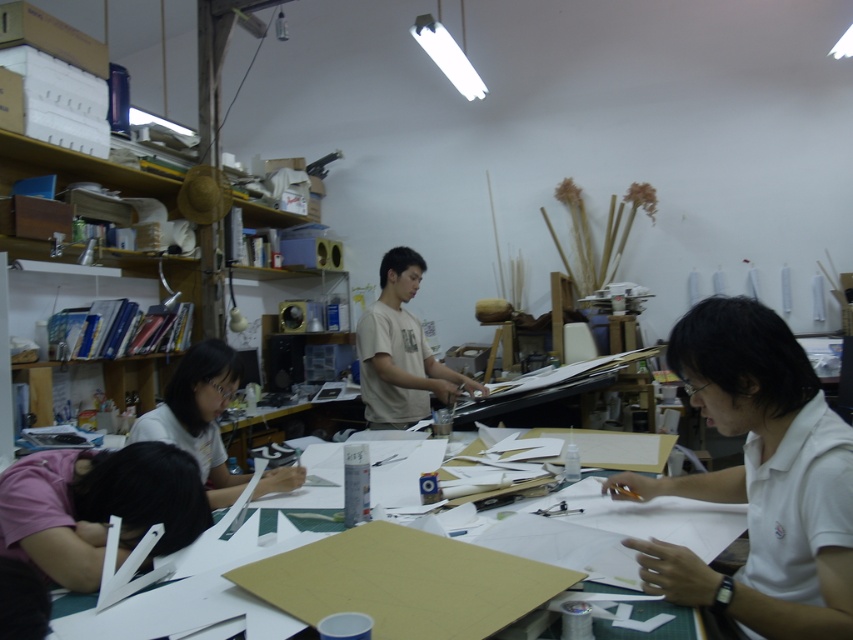
Question: Does white matte shirt at lower right have a smaller size compared to white matte shirt at center?

Choices:
 (A) no
 (B) yes

Answer: (A)

Question: Which of these objects is positioned farthest from the white matte shirt at center?

Choices:
 (A) white matte shirt at lower right
 (B) white paper at center
 (C) light brown t-shirt at center

Answer: (A)

Question: Which of the following is the closest to the observer?

Choices:
 (A) white matte shirt at center
 (B) light brown t-shirt at center
 (C) white matte shirt at lower right

Answer: (C)

Question: Which point is closer to the camera taking this photo?

Choices:
 (A) (456, 396)
 (B) (795, 342)
 (C) (680, 538)
 (D) (186, 385)

Answer: (B)

Question: Does white paper at center have a smaller size compared to light brown t-shirt at center?

Choices:
 (A) no
 (B) yes

Answer: (B)

Question: Does white matte shirt at lower right appear under white matte shirt at center?

Choices:
 (A) yes
 (B) no

Answer: (B)